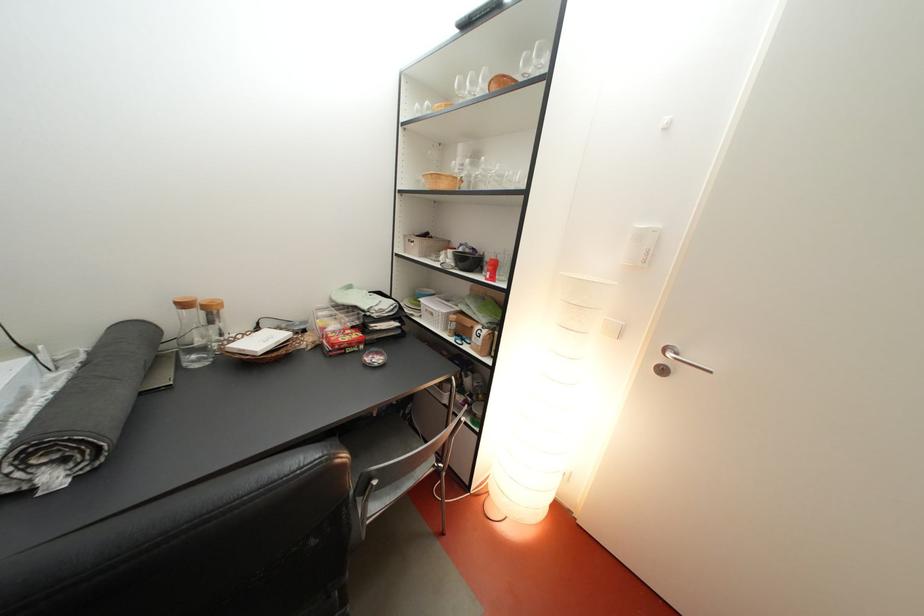
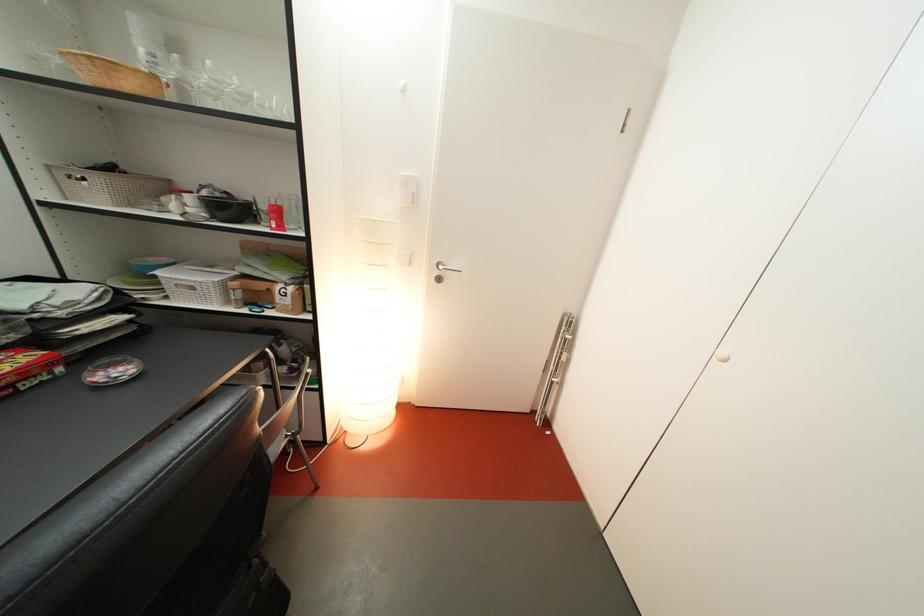
In the second image, find the point that corresponds to [438,241] in the first image.

(122, 175)